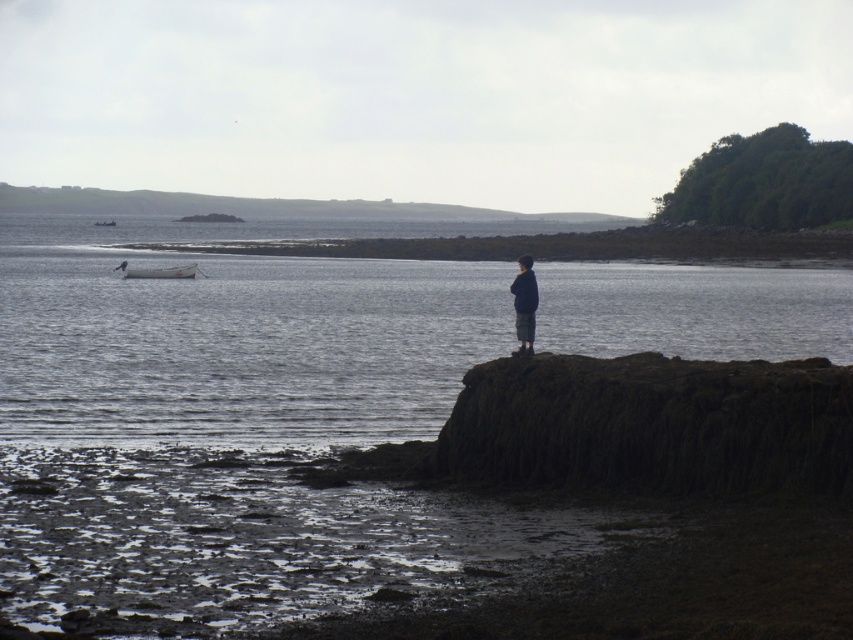
Who is lower down, dark gray water at center or dark blue sweater at center?

Positioned lower is dark blue sweater at center.

Does dark gray water at center appear under dark blue sweater at center?

No.

Between point (642, 305) and point (517, 298), which one is positioned behind?

The point (642, 305) is more distant.

Identify the location of dark gray water at center. The height and width of the screenshot is (640, 853). (234, 336).

Is dark gray water at center to the left of white matte boat at left from the viewer's perspective?

Correct, you'll find dark gray water at center to the left of white matte boat at left.

Measure the distance between point (283, 292) and camera.

Point (283, 292) is 53.05 meters from camera.

Who is more distant from viewer, (604, 300) or (190, 272)?

The point (190, 272) is more distant.

Identify the location of dark gray water at center. (234, 336).

Who is shorter, dark gray water at center or white plastic boat at left?

white plastic boat at left is shorter.

Can you confirm if dark gray water at center is positioned above white plastic boat at left?

Actually, dark gray water at center is below white plastic boat at left.

Who is more distant from viewer, (325, 369) or (103, 220)?

The point (103, 220) is behind.

Locate an element on the screen. dark gray water at center is located at coordinates (234, 336).